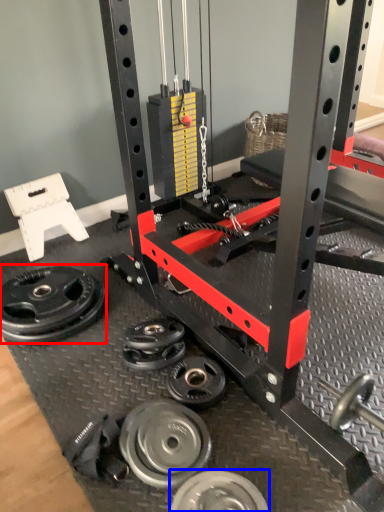
Question: Which object is further to the camera taking this photo, wheel (highlighted by a red box) or wheel (highlighted by a blue box)?

Choices:
 (A) wheel
 (B) wheel

Answer: (A)